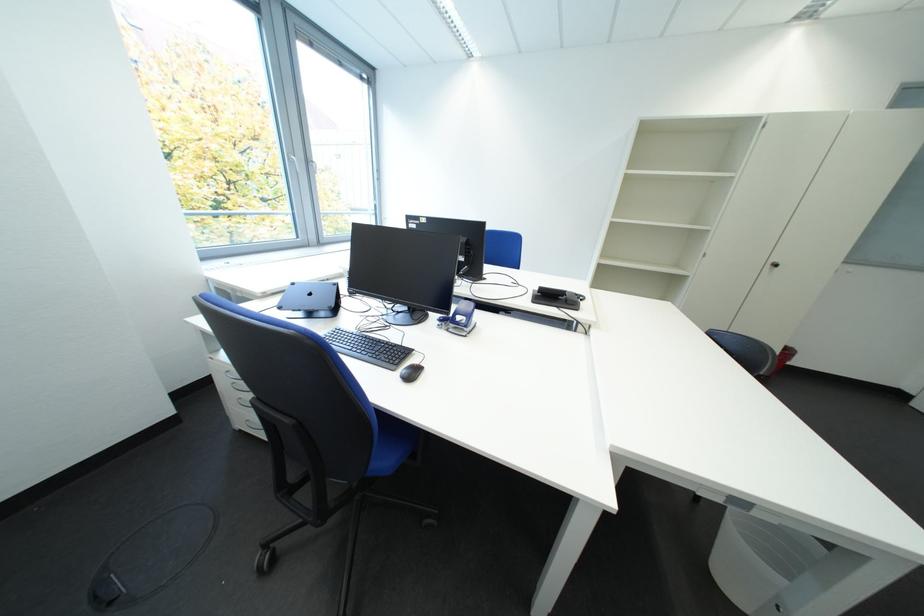
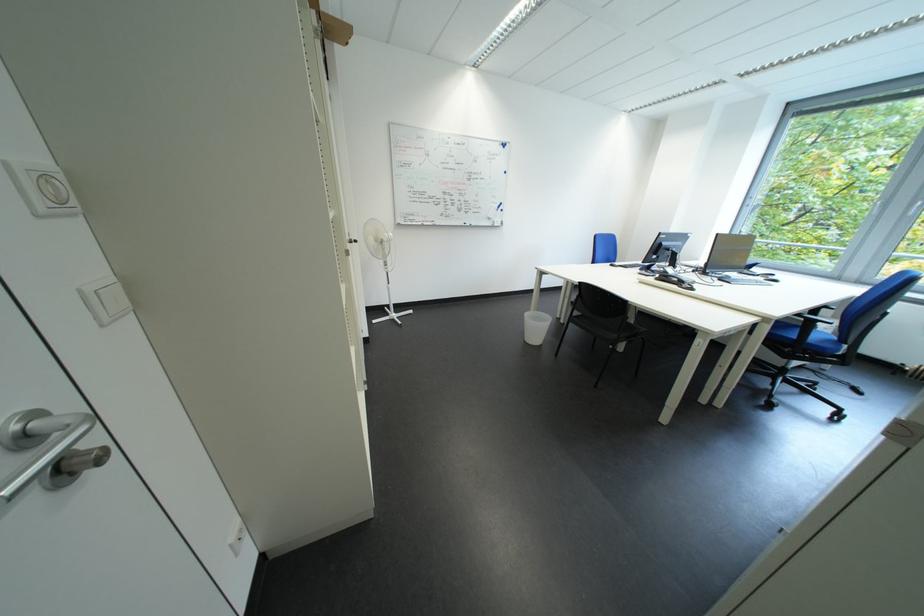
The point at (590, 312) is marked in the first image. Where is the corresponding point in the second image?

(669, 282)